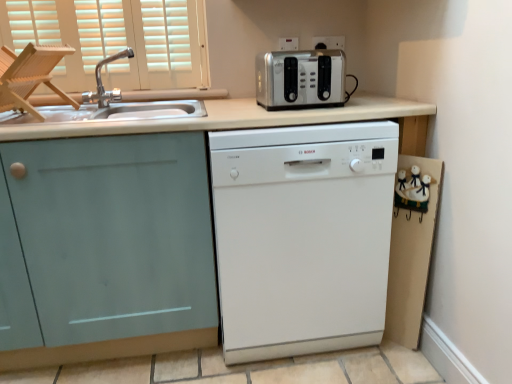
At what (x,y) coordinates should I click in order to perform the action: click on white glossy dishwasher at center. Please return your answer as a coordinate pair (x, y). The image size is (512, 384). Looking at the image, I should click on (302, 236).

Identify the location of satin silver toaster at upper center. Image resolution: width=512 pixels, height=384 pixels. (301, 79).

Measure the distance between matte teal cabinet at left and camera.

4.07 feet.

In order to face matte teal cabinet at left, should I rotate leftwards or rightwards?

To face it directly, rotate left by 21.477 degrees.

This screenshot has width=512, height=384. What do you see at coordinates (329, 42) in the screenshot?
I see `metallic silver outlet at upper center, the first electric outlet positioned from the right` at bounding box center [329, 42].

This screenshot has width=512, height=384. What are the coordinates of `white glossy dishwasher at center` in the screenshot? It's located at (302, 236).

Find the location of a particular element. folding chair that appears behind the matte teal cabinet at left is located at coordinates (29, 76).

From the image's perspective, is matte teal cabinet at left positioned above or below wooden folding chair at left?

matte teal cabinet at left is situated lower than wooden folding chair at left in the image.

Which is behind, matte teal cabinet at left or wooden folding chair at left?

wooden folding chair at left is further away from the camera.

Based on the photo, would you say matte teal cabinet at left is inside or outside wooden folding chair at left?

matte teal cabinet at left is not inside wooden folding chair at left, it's outside.

Is wooden folding chair at left at the left side of matte teal cabinet at left?

Yes.

From the image's perspective, between wooden folding chair at left and matte teal cabinet at left, which one is located above?

wooden folding chair at left, from the image's perspective.

This screenshot has width=512, height=384. What are the coordinates of `cabinetry lying below the wooden folding chair at left (from the image's perspective)` in the screenshot? It's located at (114, 245).

Would you say wooden folding chair at left is outside matte teal cabinet at left?

Yes.

Is brushed metal faucet at upper left located within silver metallic outlet at upper center, which ranks as the 1th electric outlet in left-to-right order?

No, brushed metal faucet at upper left is located outside of silver metallic outlet at upper center, which ranks as the 1th electric outlet in left-to-right order.

Which object is further away from the camera taking this photo, silver metallic outlet at upper center, which ranks as the 1th electric outlet in left-to-right order, or brushed metal faucet at upper left?

Positioned behind is silver metallic outlet at upper center, which ranks as the 1th electric outlet in left-to-right order.

Is silver metallic outlet at upper center, which ranks as the 1th electric outlet in left-to-right order, facing away from brushed metal faucet at upper left?

No, silver metallic outlet at upper center, which ranks as the 1th electric outlet in left-to-right order, is not facing the opposite direction of brushed metal faucet at upper left.

From the image's perspective, is wooden folding chair at left beneath brushed metal faucet at upper left?

Yes, from the image's perspective, wooden folding chair at left is beneath brushed metal faucet at upper left.

Which is further, (19, 92) or (98, 90)?

Point (98, 90)

Which of these two, wooden folding chair at left or brushed metal faucet at upper left, stands taller?

With more height is wooden folding chair at left.

Is satin silver toaster at upper center at the right side of metallic silver outlet at upper center, the first electric outlet positioned from the right?

In fact, satin silver toaster at upper center is to the left of metallic silver outlet at upper center, the first electric outlet positioned from the right.

Who is smaller, satin silver toaster at upper center or metallic silver outlet at upper center, the first electric outlet positioned from the right?

metallic silver outlet at upper center, the first electric outlet positioned from the right.

Between satin silver toaster at upper center and metallic silver outlet at upper center, the first electric outlet positioned from the right, which one has smaller width?

metallic silver outlet at upper center, the first electric outlet positioned from the right.

Is silver metallic outlet at upper center, the second electric outlet in the right-to-left sequence, spatially inside white glossy dishwasher at center, or outside of it?

silver metallic outlet at upper center, the second electric outlet in the right-to-left sequence, lies outside white glossy dishwasher at center.

Is silver metallic outlet at upper center, which ranks as the 1th electric outlet in left-to-right order, thinner than white glossy dishwasher at center?

Yes, silver metallic outlet at upper center, which ranks as the 1th electric outlet in left-to-right order, is thinner than white glossy dishwasher at center.

Can you confirm if silver metallic outlet at upper center, which ranks as the 1th electric outlet in left-to-right order, is positioned to the left of white glossy dishwasher at center?

Yes, silver metallic outlet at upper center, which ranks as the 1th electric outlet in left-to-right order, is to the left of white glossy dishwasher at center.

You are a GUI agent. You are given a task and a screenshot of the screen. Output one action in this format:
    pyautogui.click(x=<x>, y=<y>)
    Task: Click on the home appliance on the right of silver metallic outlet at upper center, which ranks as the 1th electric outlet in left-to-right order
    
    Given the screenshot: What is the action you would take?
    pyautogui.click(x=302, y=236)

Which object is further away from the camera taking this photo, wooden folding chair at left or silver metallic outlet at upper center, which ranks as the 1th electric outlet in left-to-right order?

silver metallic outlet at upper center, which ranks as the 1th electric outlet in left-to-right order, is behind.

From their relative heights in the image, would you say wooden folding chair at left is taller or shorter than silver metallic outlet at upper center, which ranks as the 1th electric outlet in left-to-right order?

In the image, wooden folding chair at left appears to be taller than silver metallic outlet at upper center, which ranks as the 1th electric outlet in left-to-right order.

Can you confirm if wooden folding chair at left is thinner than silver metallic outlet at upper center, which ranks as the 1th electric outlet in left-to-right order?

No, wooden folding chair at left is not thinner than silver metallic outlet at upper center, which ranks as the 1th electric outlet in left-to-right order.

Is wooden folding chair at left inside or outside of silver metallic outlet at upper center, which ranks as the 1th electric outlet in left-to-right order?

wooden folding chair at left is spatially situated outside silver metallic outlet at upper center, which ranks as the 1th electric outlet in left-to-right order.

The width and height of the screenshot is (512, 384). In order to click on cabinetry that appears below the wooden folding chair at left (from the image's perspective) in this screenshot , I will do `click(114, 245)`.

What are the coordinates of `folding chair that is on the left side of matte teal cabinet at left` in the screenshot? It's located at (29, 76).

Estimate the real-world distances between objects in this image. Which object is further from white glossy dishwasher at center, matte teal cabinet at left or wooden folding chair at left?

wooden folding chair at left is positioned further to the anchor white glossy dishwasher at center.

Estimate the real-world distances between objects in this image. Which object is closer to brushed metal faucet at upper left, matte teal cabinet at left or wooden folding chair at left?

wooden folding chair at left is positioned closer to the anchor brushed metal faucet at upper left.

Estimate the real-world distances between objects in this image. Which object is further from metallic silver outlet at upper center, which is the second electric outlet from left to right, matte teal cabinet at left or silver metallic outlet at upper center, which ranks as the 1th electric outlet in left-to-right order?

matte teal cabinet at left lies further to metallic silver outlet at upper center, which is the second electric outlet from left to right, than the other object.

Looking at the image, which one is located further to wooden folding chair at left, satin silver toaster at upper center or matte teal cabinet at left?

Based on the image, satin silver toaster at upper center appears to be further to wooden folding chair at left.

Looking at the image, which one is located closer to brushed metal faucet at upper left, silver metallic outlet at upper center, the second electric outlet in the right-to-left sequence, or white glossy dishwasher at center?

Based on the image, silver metallic outlet at upper center, the second electric outlet in the right-to-left sequence, appears to be nearer to brushed metal faucet at upper left.

When comparing their distances from metallic silver outlet at upper center, which is the second electric outlet from left to right, does matte teal cabinet at left or satin silver toaster at upper center seem further?

The object further to metallic silver outlet at upper center, which is the second electric outlet from left to right, is matte teal cabinet at left.

From the image, which object appears to be nearer to satin silver toaster at upper center, metallic silver outlet at upper center, which is the second electric outlet from left to right, or silver metallic outlet at upper center, the second electric outlet in the right-to-left sequence?

Among the two, metallic silver outlet at upper center, which is the second electric outlet from left to right, is located nearer to satin silver toaster at upper center.

When comparing their distances from white glossy dishwasher at center, does metallic silver outlet at upper center, the first electric outlet positioned from the right, or silver metallic outlet at upper center, which ranks as the 1th electric outlet in left-to-right order, seem closer?

The object closer to white glossy dishwasher at center is metallic silver outlet at upper center, the first electric outlet positioned from the right.

Locate an element on the screen. The width and height of the screenshot is (512, 384). electric outlet between satin silver toaster at upper center and metallic silver outlet at upper center, which is the second electric outlet from left to right, along the z-axis is located at coordinates (288, 43).

Find the location of a particular element. The width and height of the screenshot is (512, 384). home appliance between wooden folding chair at left and metallic silver outlet at upper center, the first electric outlet positioned from the right, from left to right is located at coordinates (302, 236).

Locate an element on the screen. electric outlet between wooden folding chair at left and white glossy dishwasher at center in the horizontal direction is located at coordinates (288, 43).

The width and height of the screenshot is (512, 384). I want to click on tap between matte teal cabinet at left and satin silver toaster at upper center in the horizontal direction, so click(102, 84).